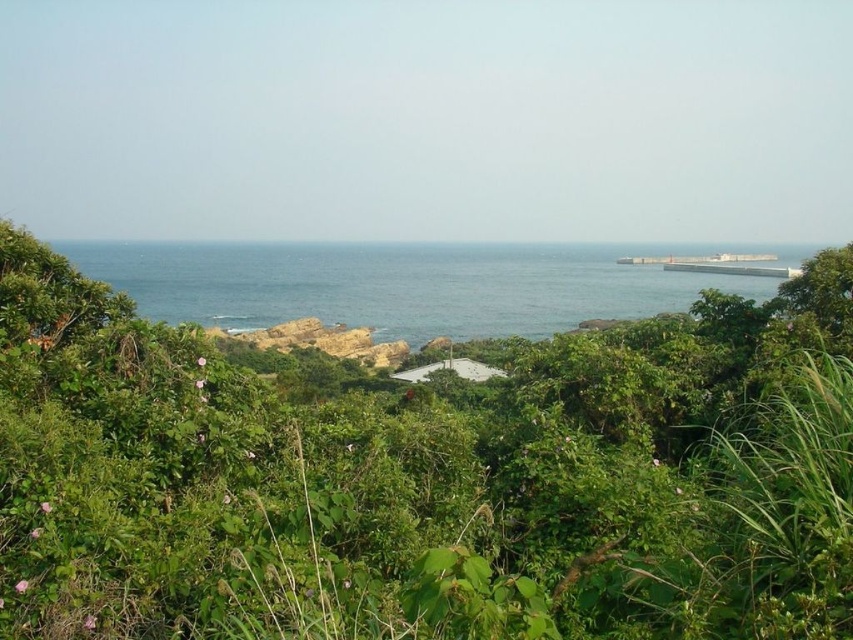
Question: Which point is farther to the camera?

Choices:
 (A) blue water at center
 (B) green leafy bush at center

Answer: (A)

Question: Does green leafy bush at center appear under blue water at center?

Choices:
 (A) no
 (B) yes

Answer: (B)

Question: Can you confirm if green leafy bush at center is positioned below blue water at center?

Choices:
 (A) yes
 (B) no

Answer: (A)

Question: Observing the image, what is the correct spatial positioning of green leafy bush at center in reference to blue water at center?

Choices:
 (A) left
 (B) right

Answer: (A)

Question: Which point is farther to the camera?

Choices:
 (A) blue water at center
 (B) green leafy bush at center

Answer: (A)